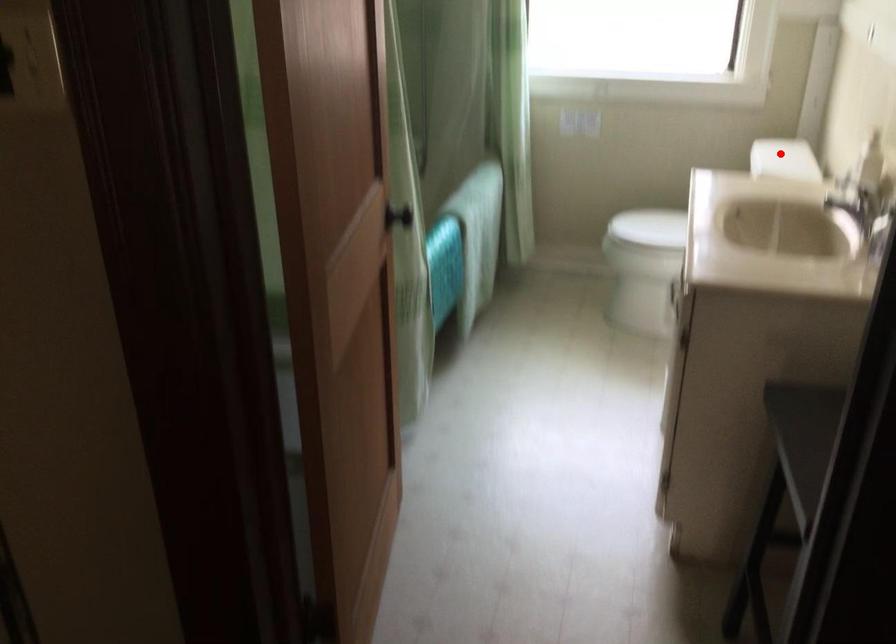
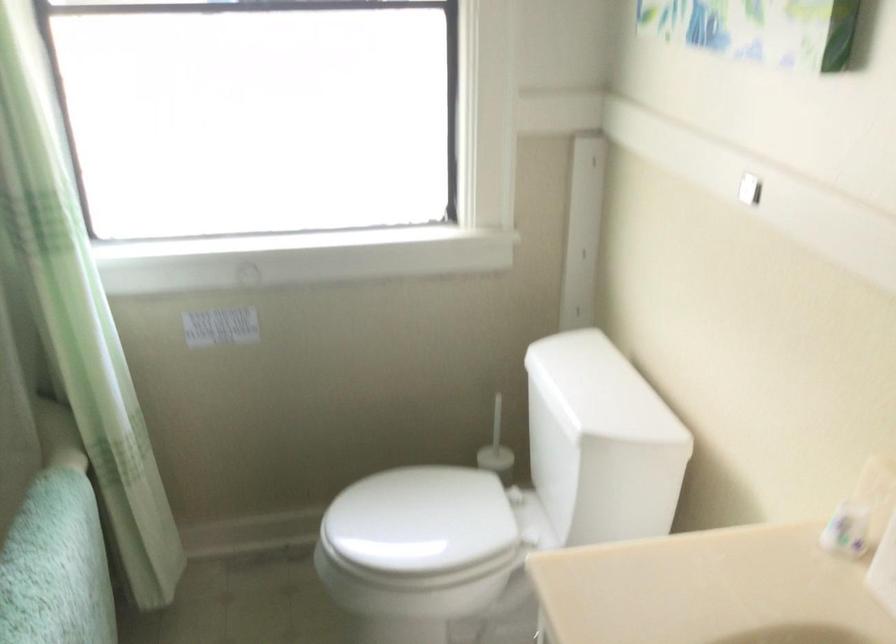
Where in the second image is the point corresponding to the highlighted location from the first image?

(599, 390)